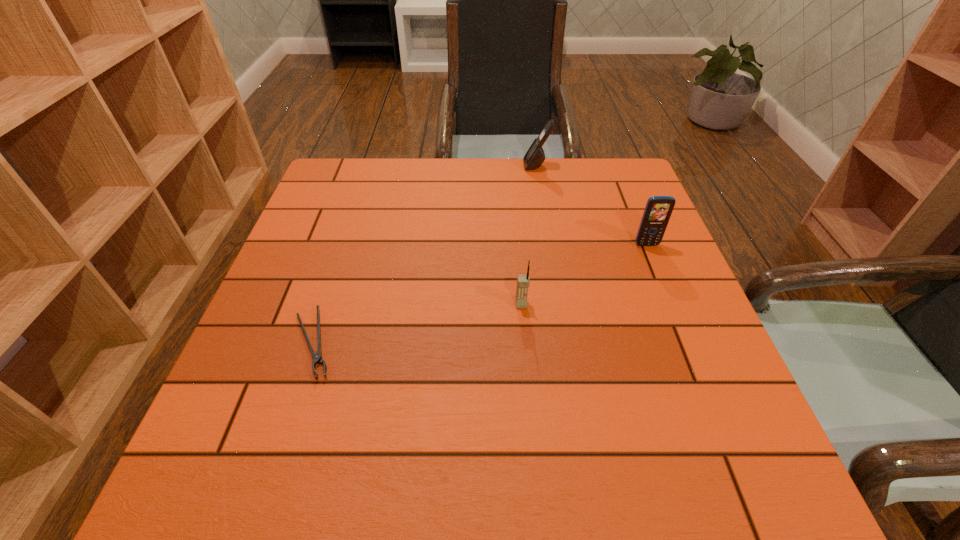
At what (x,y) coordinates should I click in order to perform the action: click on free space that is in between the farthest object and the leftmost cellular telephone. Please return your answer as a coordinate pair (x, y). This screenshot has width=960, height=540. Looking at the image, I should click on (529, 235).

Locate an element on the screen. Image resolution: width=960 pixels, height=540 pixels. vacant area that lies between the second object from right to left and the second object from left to right is located at coordinates (529, 235).

You are a GUI agent. You are given a task and a screenshot of the screen. Output one action in this format:
    pyautogui.click(x=<x>, y=<y>)
    Task: Click on the object that is the second closest one to the tongs
    
    Given the screenshot: What is the action you would take?
    pyautogui.click(x=535, y=156)

Point out which object is positioned as the third nearest to the rightmost object. Please provide its 2D coordinates. Your answer should be formatted as a tuple, i.e. [(x, y)], where the tuple contains the x and y coordinates of a point satisfying the conditions above.

[(317, 358)]

Locate which cellular telephone is the third closest to the nearest object. Please provide its 2D coordinates. Your answer should be formatted as a tuple, i.e. [(x, y)], where the tuple contains the x and y coordinates of a point satisfying the conditions above.

[(658, 209)]

Identify which cellular telephone is located as the nearest to the leftmost object. Please provide its 2D coordinates. Your answer should be formatted as a tuple, i.e. [(x, y)], where the tuple contains the x and y coordinates of a point satisfying the conditions above.

[(523, 281)]

You are a GUI agent. You are given a task and a screenshot of the screen. Output one action in this format:
    pyautogui.click(x=<x>, y=<y>)
    Task: Click on the vacant area that satisfies the following two spatial constraints: 1. on the front-facing side of the second cellular telephone from left to right; 2. on the front of the leftmost cellular telephone, where the keypad is located
    
    Given the screenshot: What is the action you would take?
    pyautogui.click(x=560, y=305)

The image size is (960, 540). I want to click on vacant space that satisfies the following two spatial constraints: 1. on the front-facing side of the second cellular telephone from left to right; 2. on the front of the second object from left to right, where the keypad is located, so click(560, 305).

You are a GUI agent. You are given a task and a screenshot of the screen. Output one action in this format:
    pyautogui.click(x=<x>, y=<y>)
    Task: Click on the free space in the image that satisfies the following two spatial constraints: 1. on the front-facing side of the second cellular telephone from right to left; 2. on the front of the nearest cellular telephone, where the keypad is located
    
    Given the screenshot: What is the action you would take?
    pyautogui.click(x=560, y=305)

Image resolution: width=960 pixels, height=540 pixels. What are the coordinates of `vacant area that satisfies the following two spatial constraints: 1. on the front-facing side of the farthest cellular telephone; 2. on the front of the leftmost cellular telephone, where the keypad is located` in the screenshot? It's located at (560, 305).